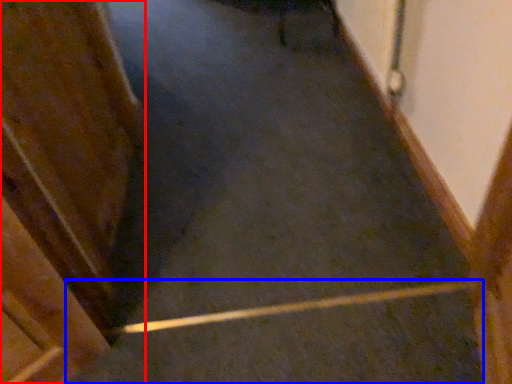
Question: Among these objects, which one is farthest to the camera, door (highlighted by a red box) or stairs (highlighted by a blue box)?

Choices:
 (A) door
 (B) stairs

Answer: (B)